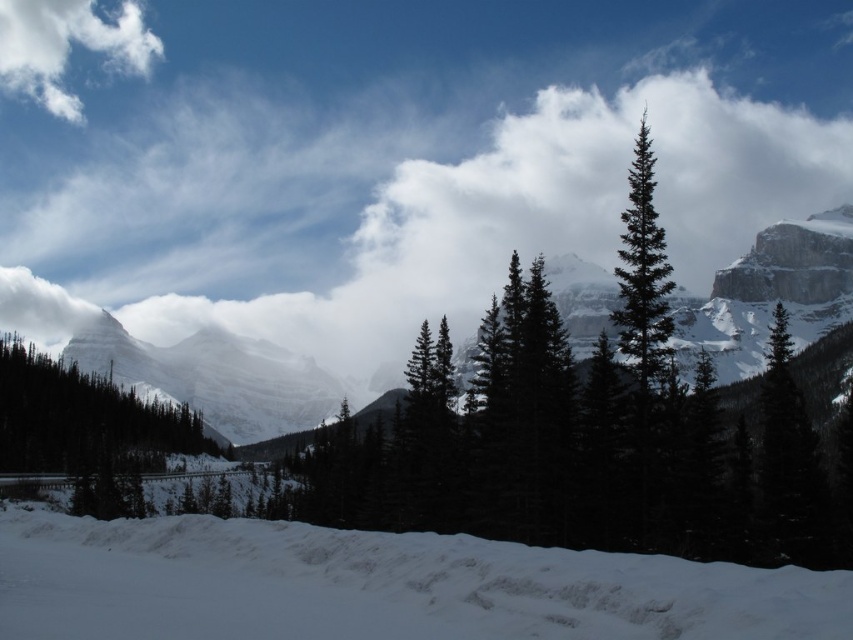
You are an airplane pilot flying over a winter landscape. You see the snowy granite mountain at center and the white fluffy cloud at upper left. Which object is positioned more to the east if the sun is setting in the west?

The snowy granite mountain at center is positioned more to the east because it is to the right of the white fluffy cloud at upper left, and since the sun is setting in the west, right side of the image corresponds to east direction.

You are a hiker planning to reach the summit of the snowy granite mountain at center. According to the coordinates provided, what is the exact location of the mountain?

The snowy granite mountain at center is located at coordinates point (213, 378).

You are a hiker planning to take a photo of the dark green textured pine tree at left and the white fluffy cloud at upper left together in the same frame. Given that your camera has a maximum zoom range of 200 meters, will you be able to capture both objects in one photo?

The distance between the dark green textured pine tree at left and the white fluffy cloud at upper left is 310.11 meters, which exceeds the camera maximum zoom range of 200 meters. Therefore, you will not be able to capture both objects in one photo.